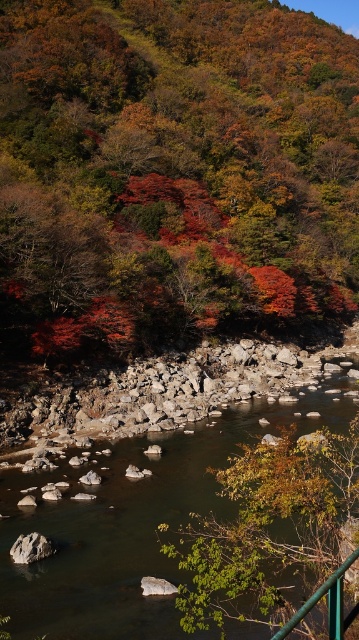
Question: Considering the real-world distances, which object is farthest from the green leafy tree at lower center?

Choices:
 (A) green metal railing at lower right
 (B) autumn leaves at upper center

Answer: (B)

Question: Can you confirm if green leafy tree at lower center is positioned to the right of green metal railing at lower right?

Choices:
 (A) no
 (B) yes

Answer: (B)

Question: Which point is farther to the camera?

Choices:
 (A) (314, 252)
 (B) (145, 500)
 (C) (277, 637)

Answer: (A)

Question: Which point is farther from the camera taking this photo?

Choices:
 (A) (176, 557)
 (B) (10, 170)
 (C) (315, 596)
 (D) (73, 449)

Answer: (B)

Question: Is the position of green leafy tree at lower center less distant than that of green metal railing at lower right?

Choices:
 (A) no
 (B) yes

Answer: (A)

Question: Does autumn leaves at upper center have a lesser width compared to smooth rock stream at center?

Choices:
 (A) no
 (B) yes

Answer: (A)